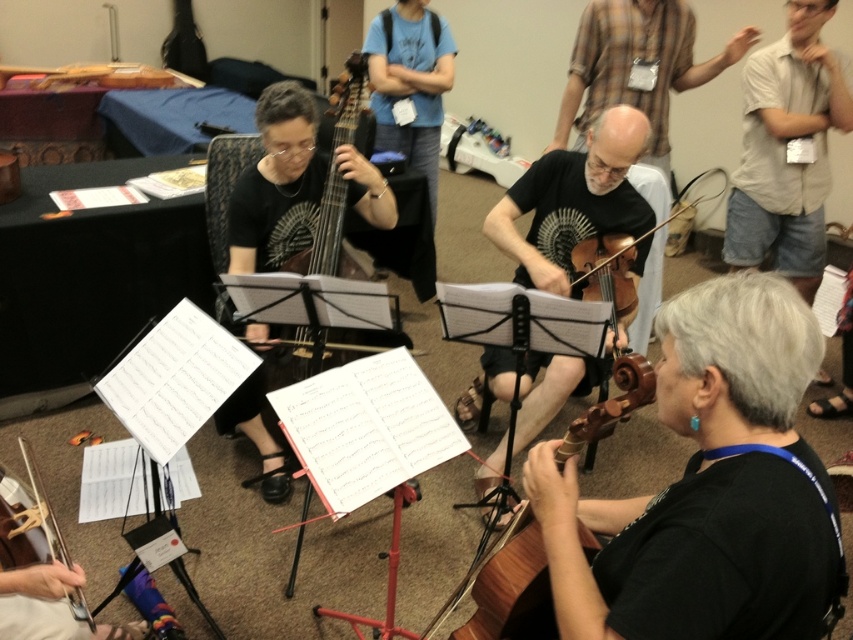
You are standing in the room and want to move from point A to point B. Point A is at coordinates point (569,228) and point B is at coordinates point (474,580). Which point is closer to you?

Point A at coordinates point (569,228) is closer to you because it is further to the viewer than point B at coordinates point (474,580).